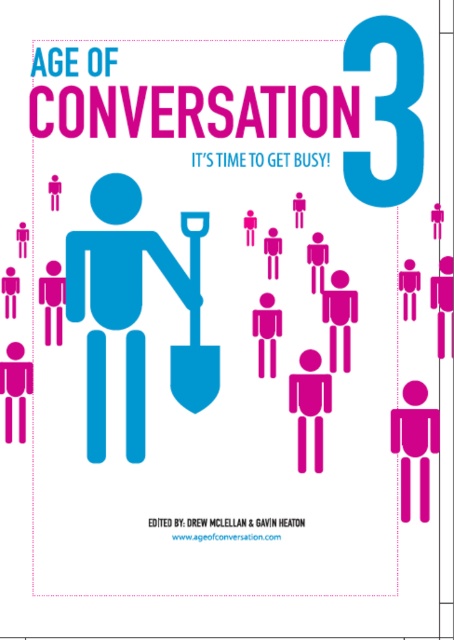
Which is above, matte blue figure at center or blue matte shovel at center?

blue matte shovel at center is higher up.

Does matte blue figure at center have a greater height compared to blue matte shovel at center?

Indeed, matte blue figure at center has a greater height compared to blue matte shovel at center.

This screenshot has width=454, height=640. I want to click on matte blue figure at center, so click(141, 296).

Identify the location of matte blue figure at center. This screenshot has height=640, width=454. (141, 296).